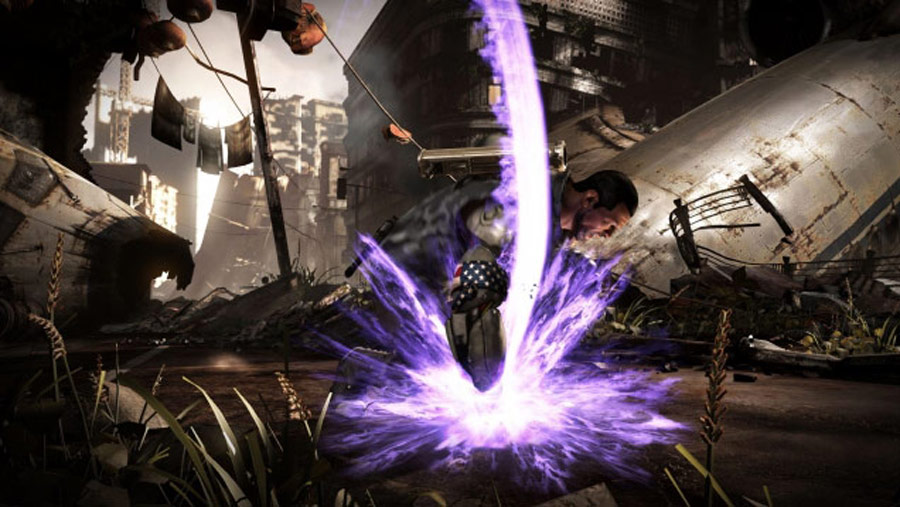
I want to click on tall plant, so click(716, 382).